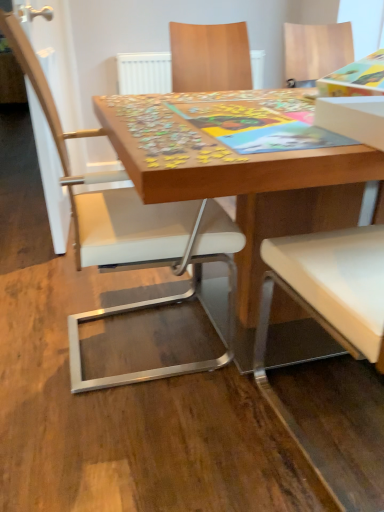
Question: Is white leather chair at center turned away from wooden puzzle board at center?

Choices:
 (A) yes
 (B) no

Answer: (A)

Question: Can you confirm if white leather chair at center is bigger than wooden puzzle board at center?

Choices:
 (A) no
 (B) yes

Answer: (A)

Question: Is white leather chair at center located outside wooden puzzle board at center?

Choices:
 (A) no
 (B) yes

Answer: (A)

Question: From a real-world perspective, is white leather chair at center under wooden puzzle board at center?

Choices:
 (A) no
 (B) yes

Answer: (A)

Question: Is white leather chair at center thinner than wooden puzzle board at center?

Choices:
 (A) no
 (B) yes

Answer: (B)

Question: Is white leather chair at center wider or thinner than wooden puzzle board at center?

Choices:
 (A) wide
 (B) thin

Answer: (B)

Question: Is white leather chair at center inside the boundaries of wooden puzzle board at center, or outside?

Choices:
 (A) inside
 (B) outside

Answer: (A)

Question: In the image, is white leather chair at center positioned in front of or behind wooden puzzle board at center?

Choices:
 (A) front
 (B) behind

Answer: (B)

Question: From the image's perspective, is white leather chair at center positioned above or below wooden puzzle board at center?

Choices:
 (A) below
 (B) above

Answer: (B)

Question: Relative to white leather chair at center, is wooden puzzle pieces at center in front or behind?

Choices:
 (A) front
 (B) behind

Answer: (A)

Question: Is point (258, 493) positioned closer to the camera than point (230, 294)?

Choices:
 (A) farther
 (B) closer

Answer: (B)

Question: From a real-world perspective, is wooden puzzle pieces at center physically located above or below white leather chair at center?

Choices:
 (A) above
 (B) below

Answer: (B)

Question: From the image's perspective, relative to white leather chair at center, is wooden puzzle pieces at center above or below?

Choices:
 (A) below
 (B) above

Answer: (B)

Question: In terms of size, does white leather chair at center appear bigger or smaller than wooden puzzle pieces at center?

Choices:
 (A) small
 (B) big

Answer: (B)

Question: In the image, is white leather chair at center positioned in front of or behind wooden puzzle pieces at center?

Choices:
 (A) front
 (B) behind

Answer: (B)